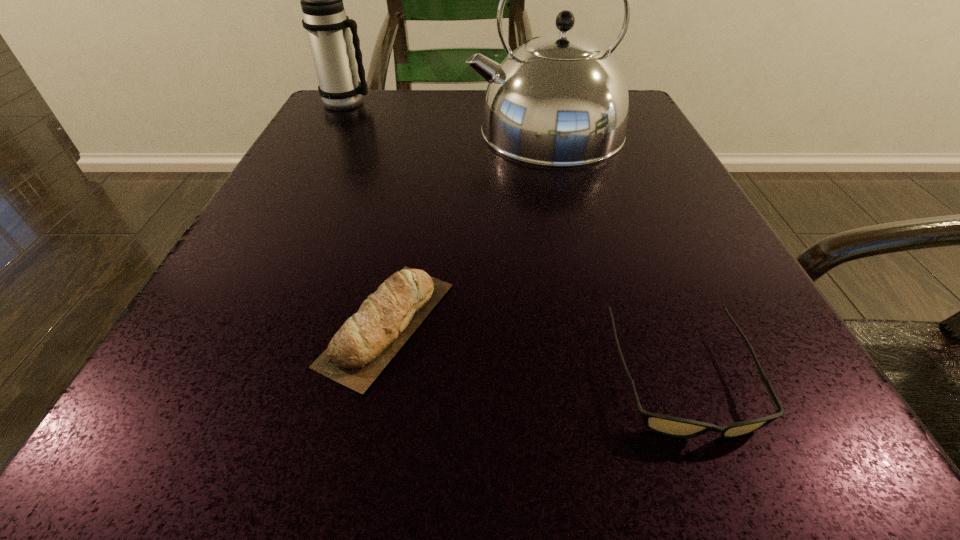
The image size is (960, 540). In order to click on kettle that is at the far edge in this screenshot , I will do [x=559, y=100].

The width and height of the screenshot is (960, 540). What are the coordinates of `thermos bottle that is at the far edge` in the screenshot? It's located at (324, 18).

This screenshot has height=540, width=960. I want to click on object positioned at the near edge, so click(671, 426).

This screenshot has width=960, height=540. I want to click on thermos bottle located at the left edge, so click(324, 18).

Where is `pita bread that is positioned at the left edge`? This screenshot has width=960, height=540. pita bread that is positioned at the left edge is located at coordinates (365, 344).

Find the location of a particular element. kettle that is at the right edge is located at coordinates (559, 100).

Locate an element on the screen. The image size is (960, 540). sunglasses that is at the right edge is located at coordinates (671, 426).

The width and height of the screenshot is (960, 540). What are the coordinates of `object that is positioned at the far left corner` in the screenshot? It's located at (324, 18).

Identify the location of object that is positioned at the far right corner. The image size is (960, 540). (559, 100).

The height and width of the screenshot is (540, 960). In order to click on object positioned at the near right corner in this screenshot , I will do click(671, 426).